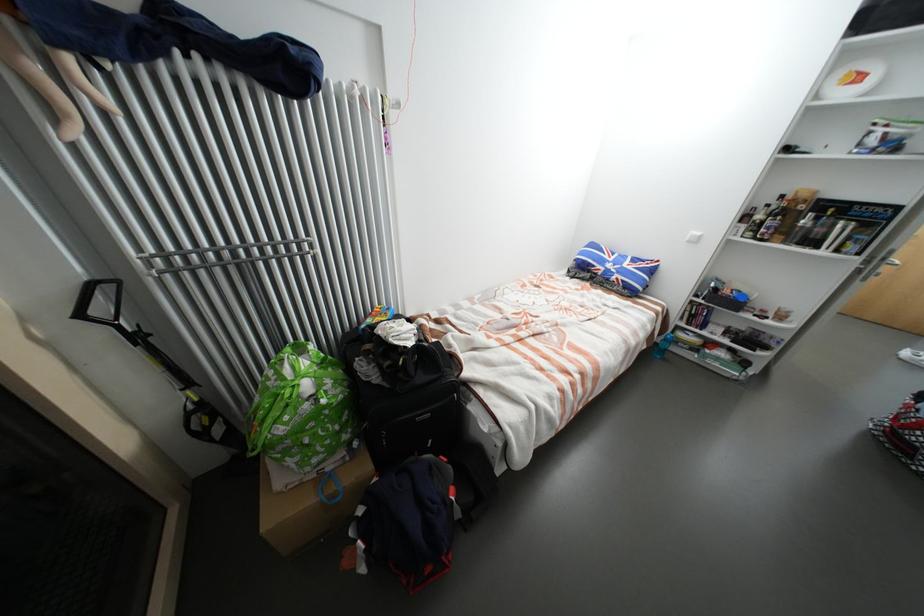
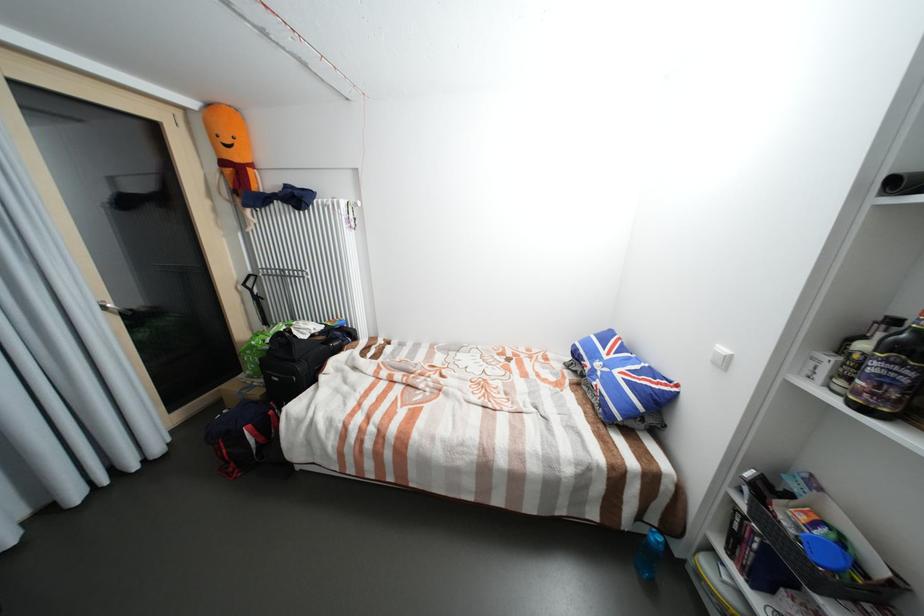
The point at (x=768, y=241) is marked in the first image. Where is the corresponding point in the second image?

(870, 410)